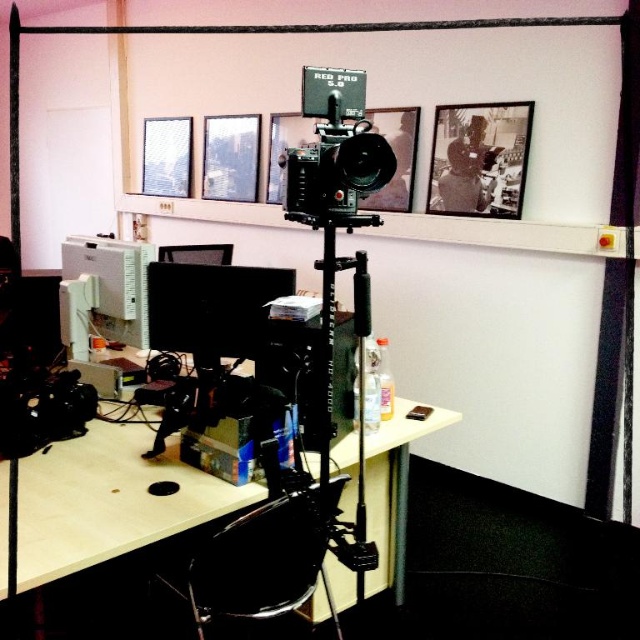
You are standing in the workspace and want to place a new photo frame on the desk. The existing black matte picture frame at upper center is currently at point (x=480, y=157). Is there enough space on the desk to place the new frame without overlapping any existing items?

The black matte picture frame at upper center is located at point (x=480, y=157). Since the desk has items like a computer monitor, computer tower, papers, and bottles, there might not be enough space to place the new frame without overlapping existing items. Check the desk layout carefully before placing it.

You are an interior designer planning to hang two picture frames on a wall. You have the metallic silver picture frame at upper center and the black glossy picture frame at upper center. Based on their sizes, which one should you place higher to ensure they appear balanced?

The metallic silver picture frame at upper center is much taller than the black glossy picture frame at upper center, so to balance their visual weight, place the taller metallic silver picture frame at upper center slightly lower and the smaller black glossy picture frame at upper center higher to create a balanced composition.